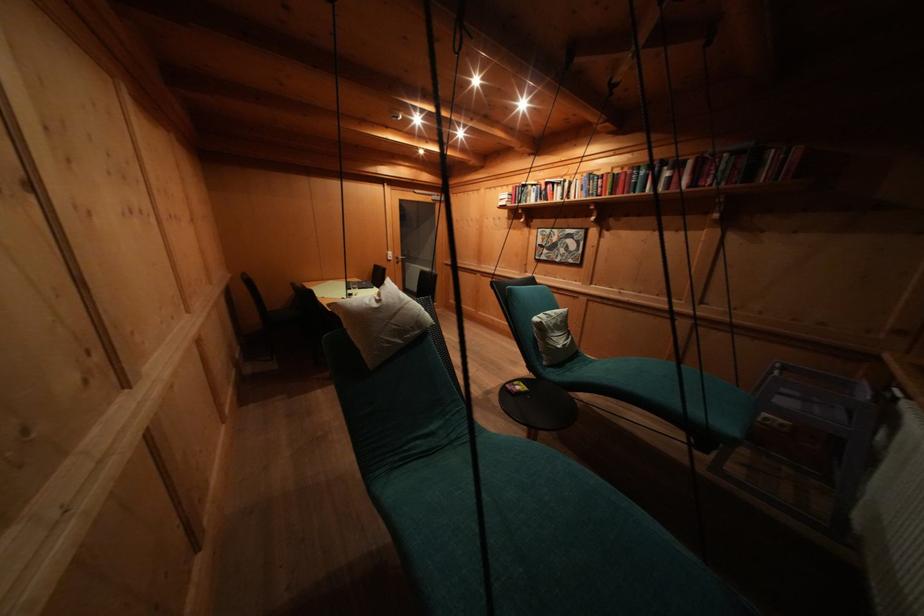
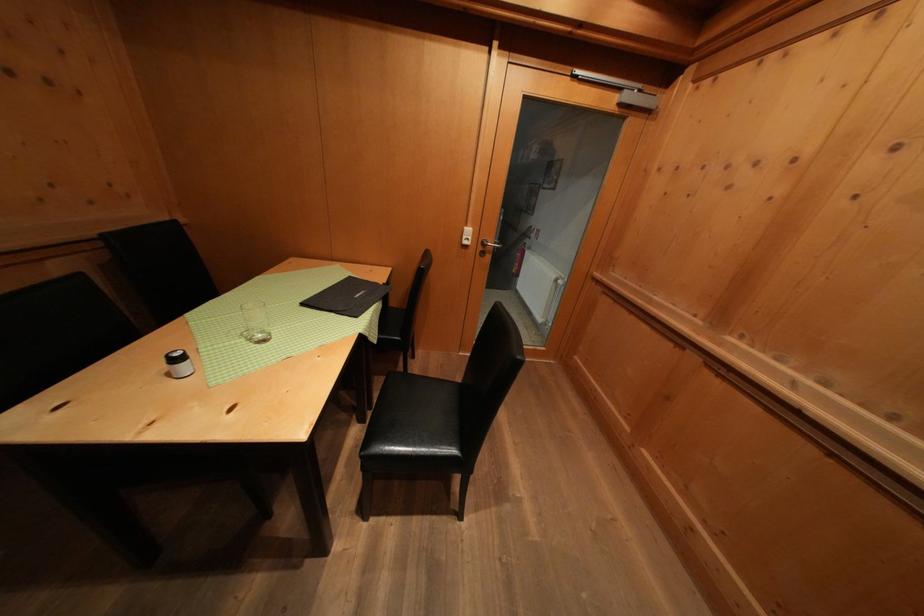
Find the pixel in the second image that matches pixel 404 262 in the first image.

(490, 249)